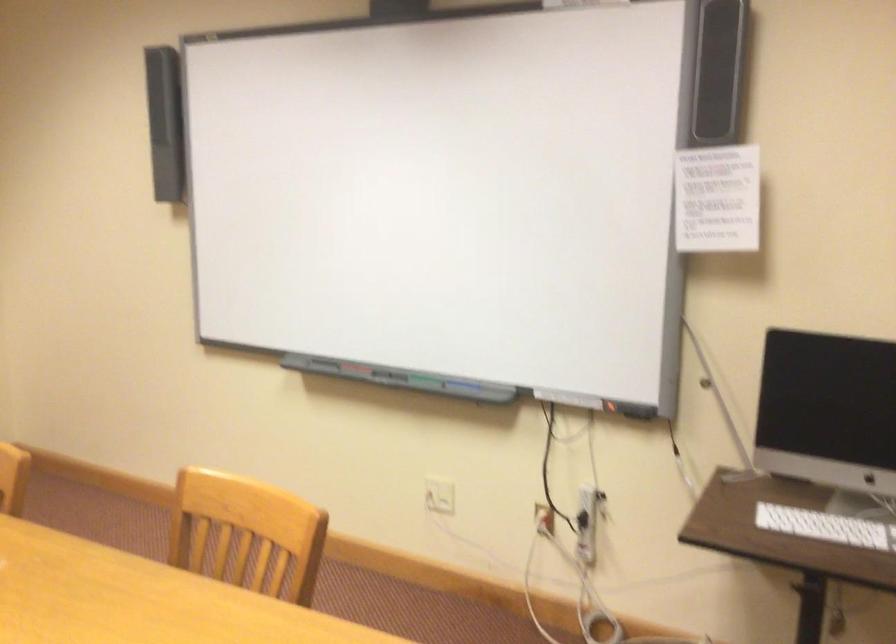
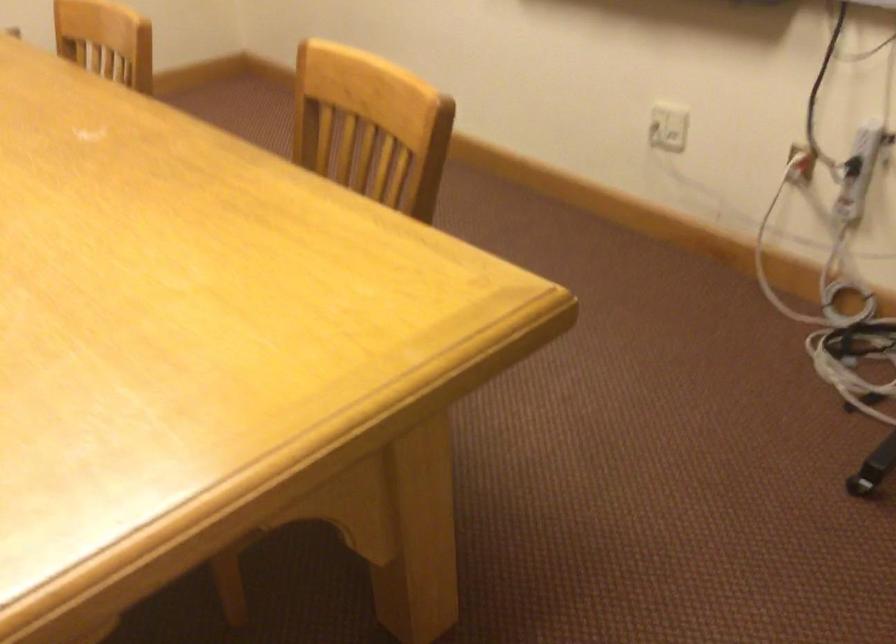
Locate, in the second image, the point that corresponds to (435,495) in the first image.

(668, 127)